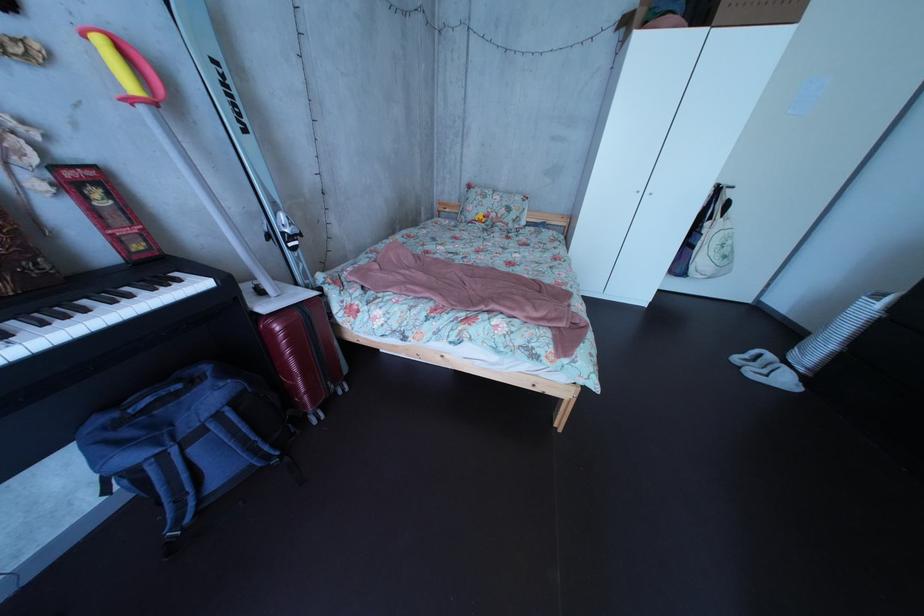
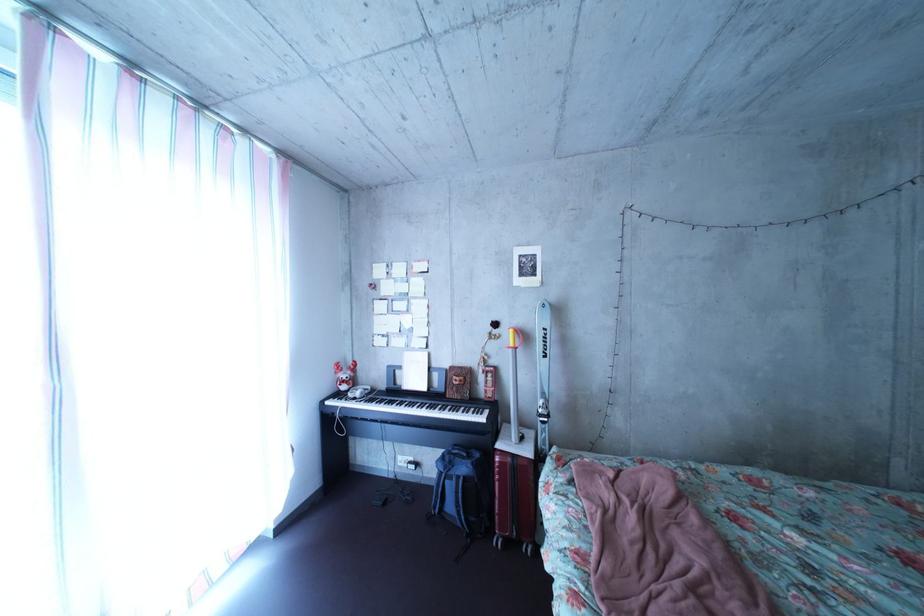
Locate, in the second image, the point that corresponds to point 225,407 in the first image.

(479, 477)